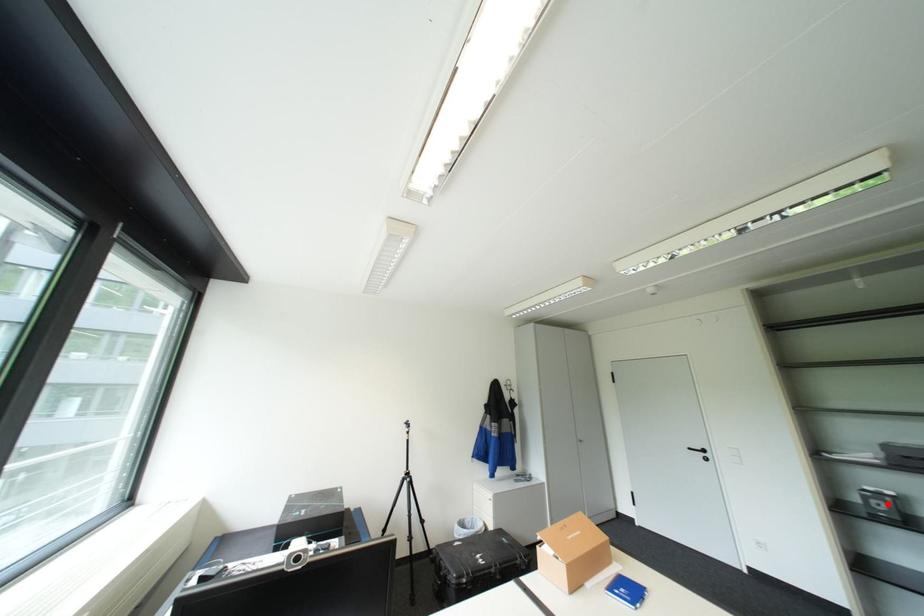
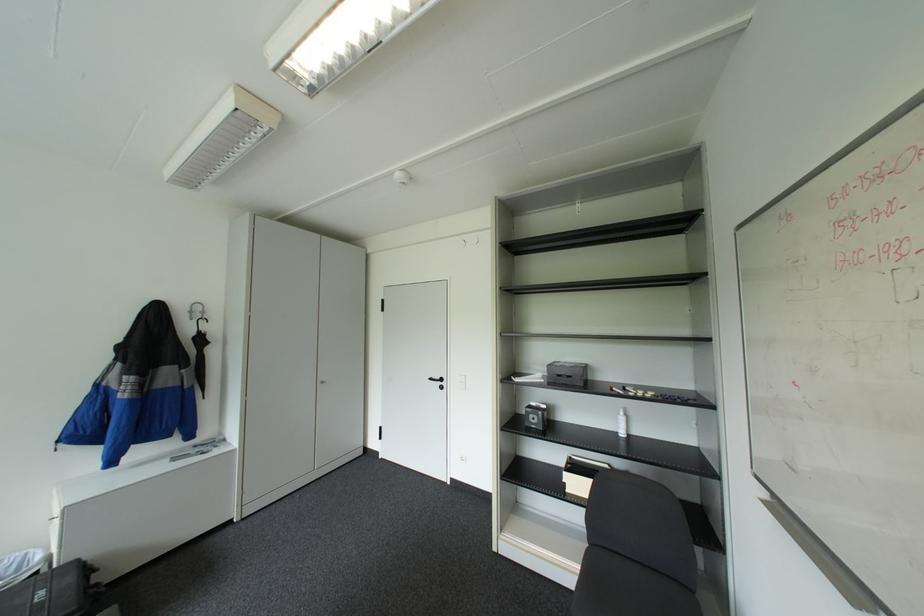
Question: I am providing you with two images of the same scene from different viewpoints. A red point is shown in image1. For the corresponding object point in image2, is it positioned nearer or farther from the camera?

Choices:
 (A) Nearer
 (B) Farther

Answer: (B)